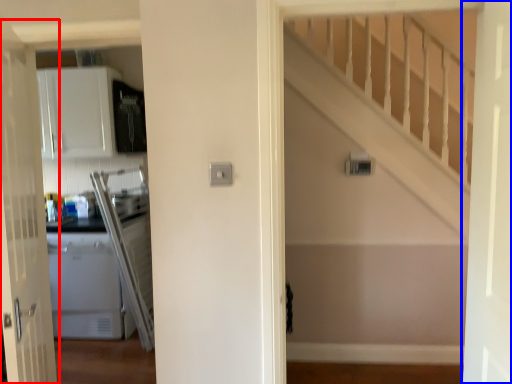
Question: Which point is closer to the camera, door (highlighted by a red box) or door (highlighted by a blue box)?

Choices:
 (A) door
 (B) door

Answer: (B)